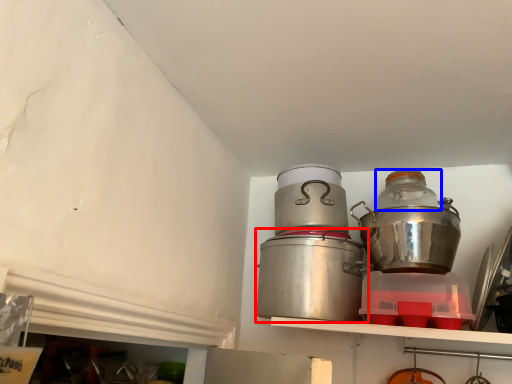
Question: Which of the following is the farthest to the observer, crock pot (highlighted by a red box) or bottle (highlighted by a blue box)?

Choices:
 (A) crock pot
 (B) bottle

Answer: (B)